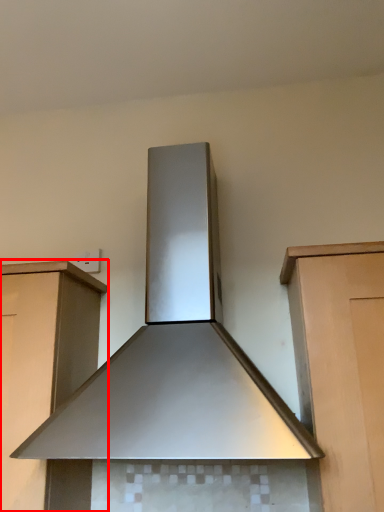
Question: Observing the image, what is the correct spatial positioning of cabinetry (annotated by the red box) in reference to home appliance?

Choices:
 (A) right
 (B) left

Answer: (B)